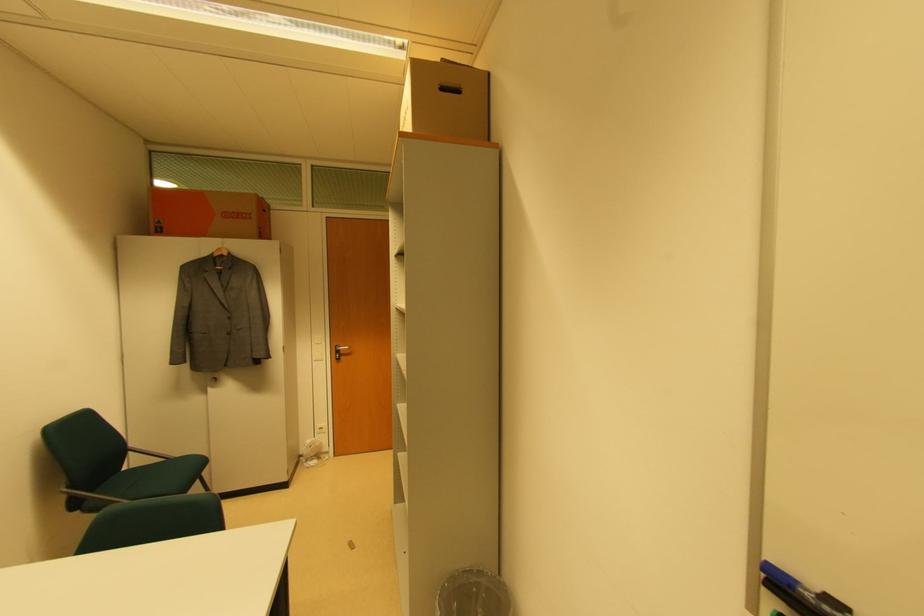
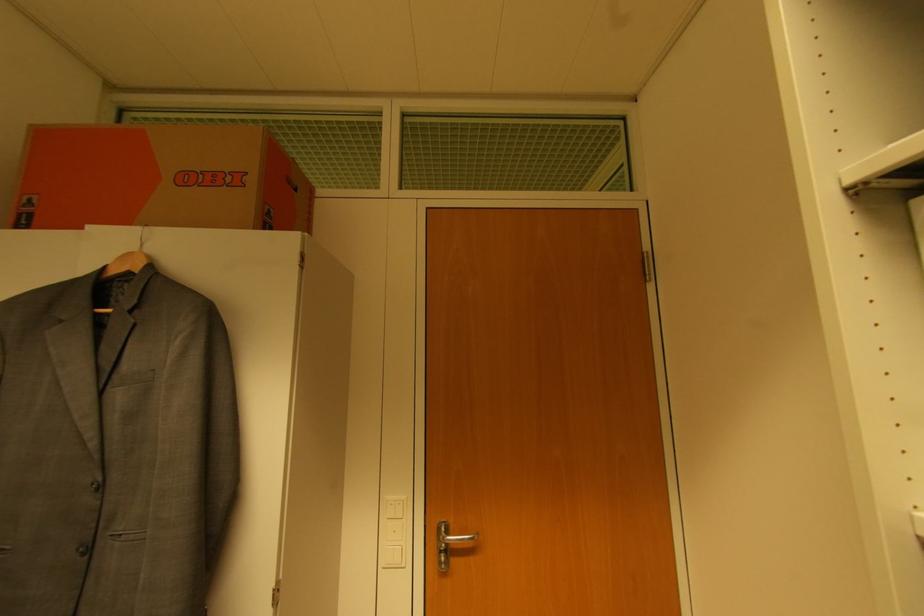
Find the pixel in the second image that matches point 163,230 in the first image.

(32, 217)